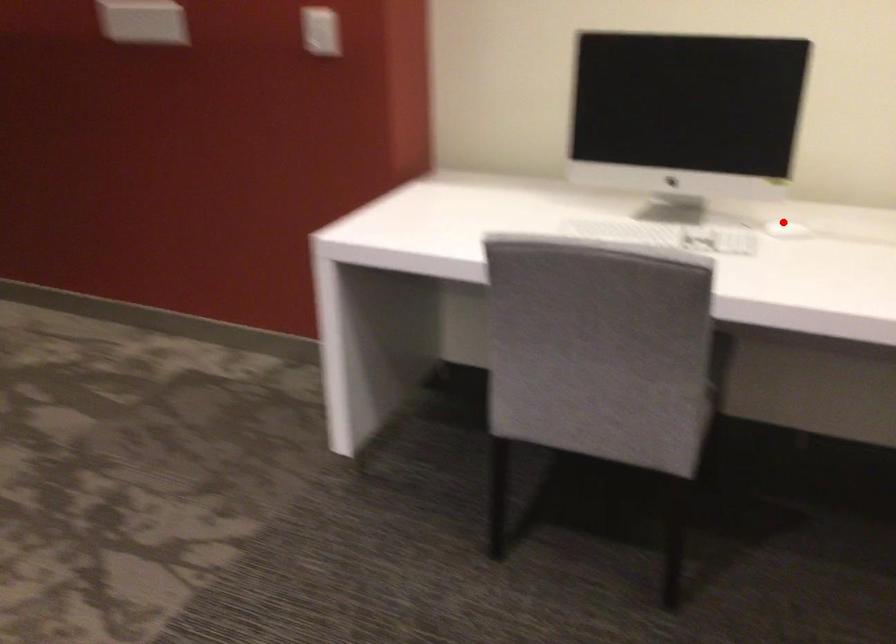
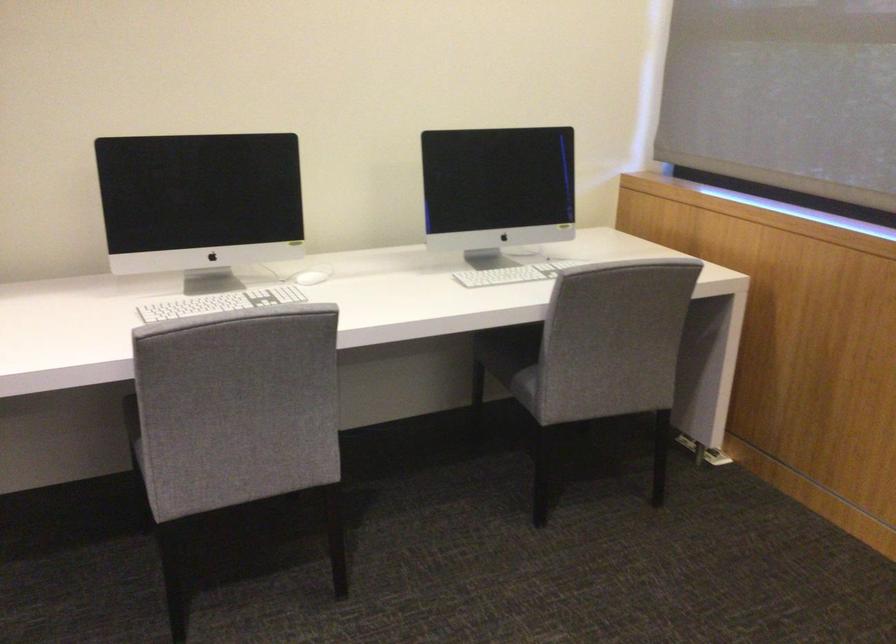
Find the pixel in the second image that matches the highlighted location in the first image.

(307, 277)